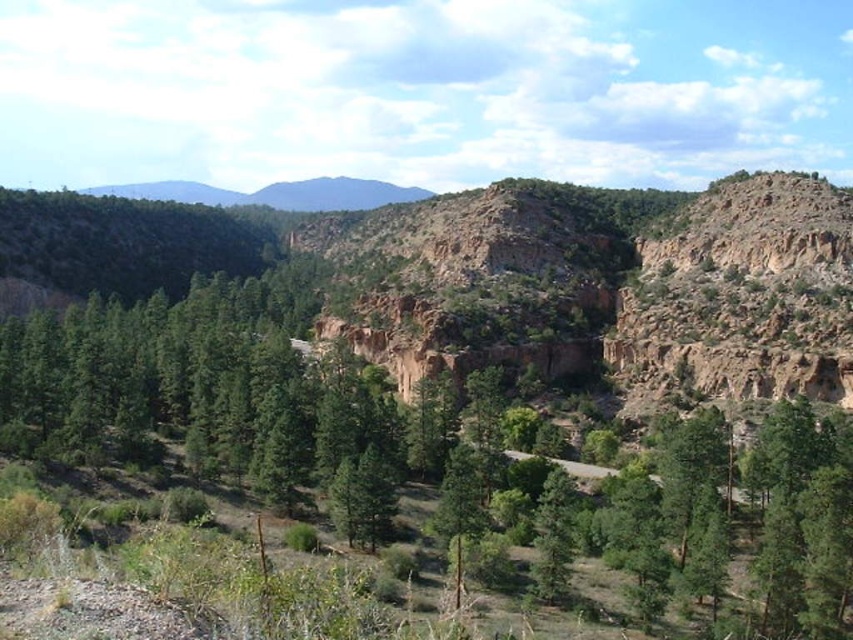
Question: Which point appears farthest from the camera in this image?

Choices:
 (A) (21, 397)
 (B) (465, 515)

Answer: (A)

Question: Can you confirm if green matte tree at center is positioned below green rough bark tree at center?

Choices:
 (A) yes
 (B) no

Answer: (B)

Question: Is green matte tree at center thinner than green rough bark tree at center?

Choices:
 (A) yes
 (B) no

Answer: (B)

Question: Is green matte tree at center to the right of green rough bark tree at center from the viewer's perspective?

Choices:
 (A) no
 (B) yes

Answer: (A)

Question: Which point is farther to the camera?

Choices:
 (A) (74, 314)
 (B) (473, 512)

Answer: (A)